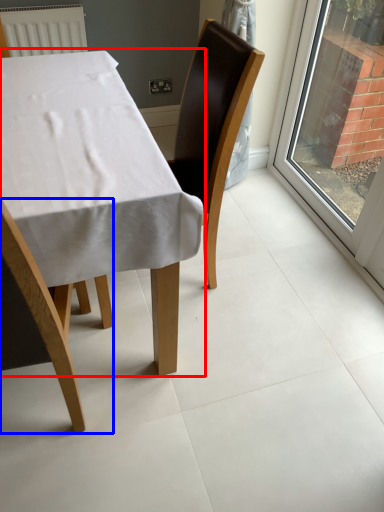
Question: Which of the following is the farthest to the observer, table (highlighted by a red box) or chair (highlighted by a blue box)?

Choices:
 (A) table
 (B) chair

Answer: (A)